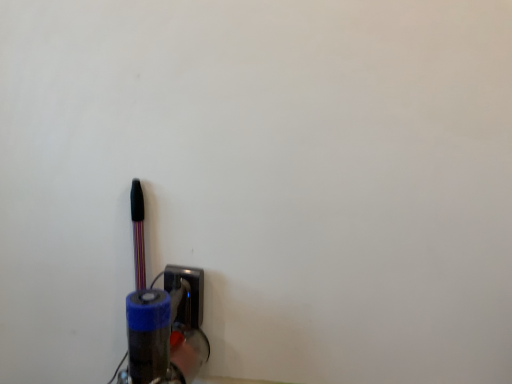
Question: Is metallic socket at lower center spatially inside metallic pen at left, or outside of it?

Choices:
 (A) outside
 (B) inside

Answer: (A)

Question: From their relative heights in the image, would you say metallic socket at lower center is taller or shorter than metallic pen at left?

Choices:
 (A) tall
 (B) short

Answer: (B)

Question: Based on their positions, is metallic socket at lower center located to the left or right of metallic pen at left?

Choices:
 (A) right
 (B) left

Answer: (A)

Question: From a real-world perspective, relative to metallic socket at lower center, is metallic pen at left vertically above or below?

Choices:
 (A) above
 (B) below

Answer: (A)

Question: Is metallic pen at left to the left or to the right of metallic socket at lower center in the image?

Choices:
 (A) left
 (B) right

Answer: (A)

Question: Is metallic pen at left bigger or smaller than metallic socket at lower center?

Choices:
 (A) big
 (B) small

Answer: (A)

Question: In the image, is metallic pen at left positioned in front of or behind metallic socket at lower center?

Choices:
 (A) front
 (B) behind

Answer: (A)